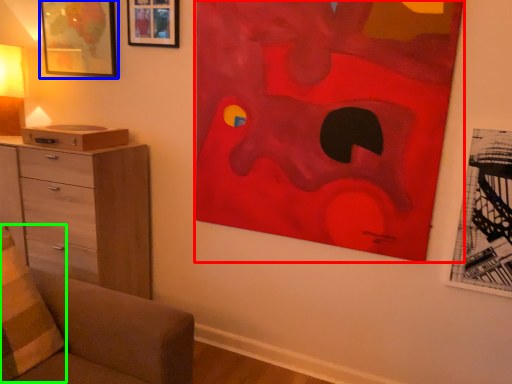
Question: Which object is positioned farthest from art (highlighted by a red box)? Select from picture frame (highlighted by a blue box) and pillow (highlighted by a green box).

Choices:
 (A) picture frame
 (B) pillow

Answer: (B)